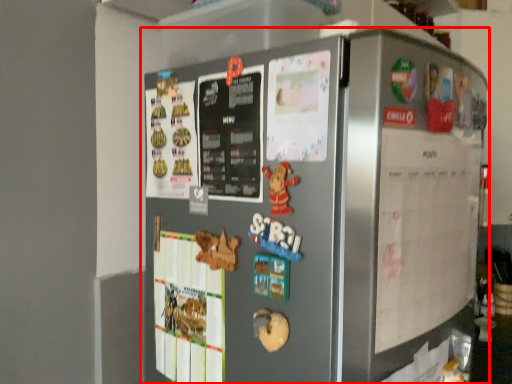
Question: From the image's perspective, where is refrigerator (annotated by the red box) located in relation to menu in the image?

Choices:
 (A) below
 (B) above

Answer: (A)